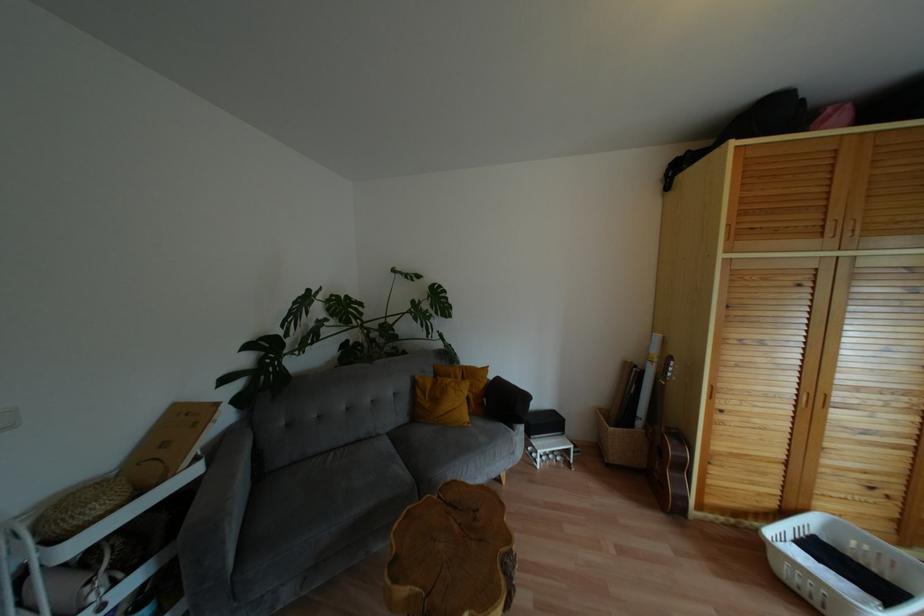
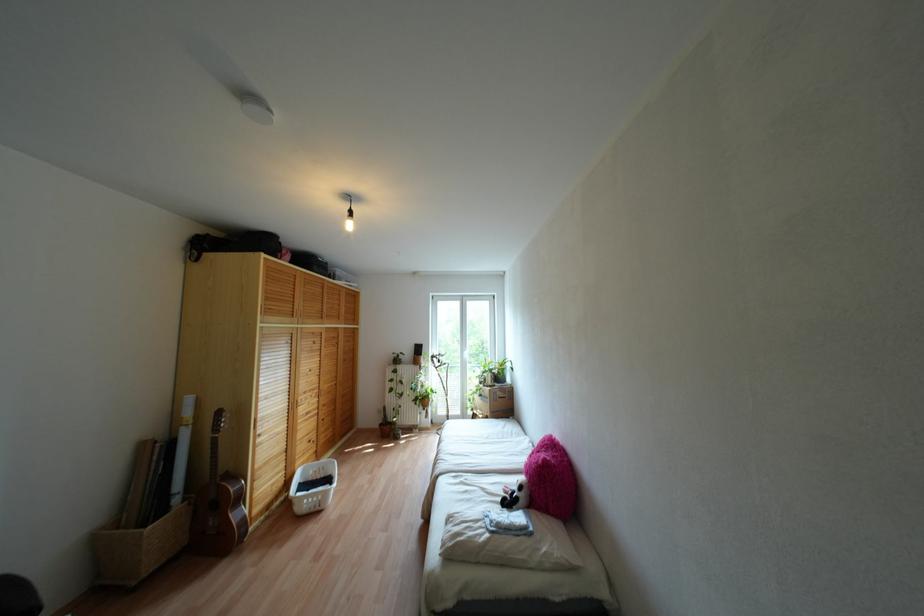
Question: I am providing you with two images of the same scene from different viewpoints. Please identify which objects are invisible in image2.

Choices:
 (A) potted plant
 (B) louvered cabinet door
 (C) acoustic guitar
 (D) none of these

Answer: (D)